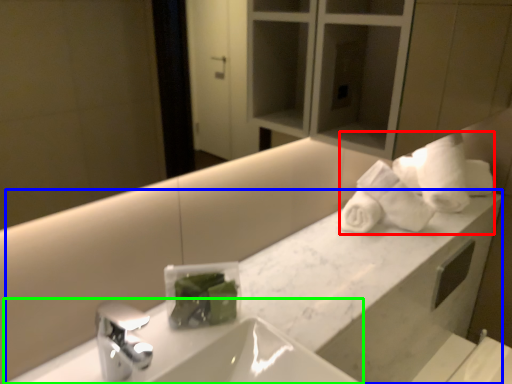
Question: Which is nearer to the bath towel (highlighted by a red box)? counter (highlighted by a blue box) or sink (highlighted by a green box).

Choices:
 (A) counter
 (B) sink

Answer: (A)